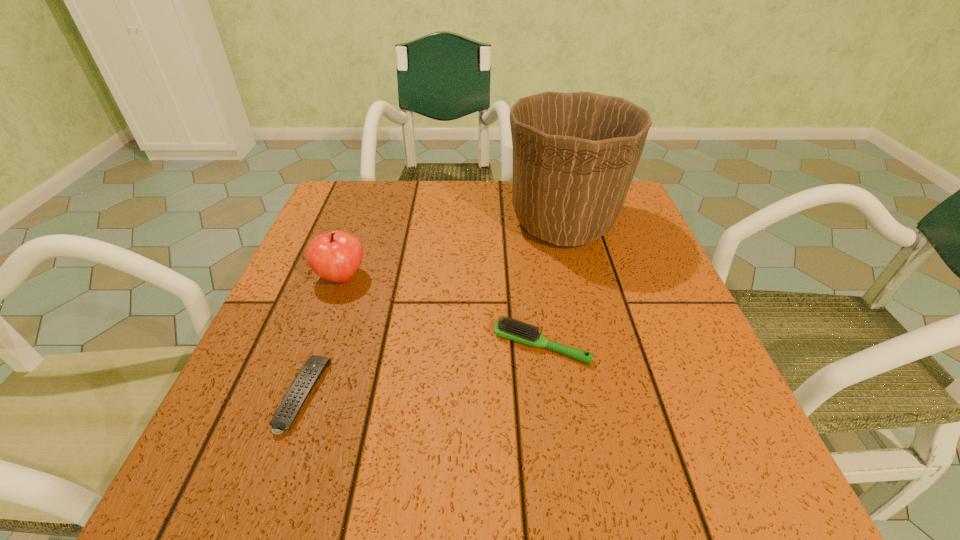
This screenshot has height=540, width=960. Find the location of `vacant space that is in between the remote control and the second shortest object`. vacant space that is in between the remote control and the second shortest object is located at coordinates (422, 370).

The image size is (960, 540). What are the coordinates of `unoccupied position between the second tallest object and the remote control` in the screenshot? It's located at (323, 336).

Locate an element on the screen. free space between the tallest object and the hairbrush is located at coordinates (553, 284).

What are the coordinates of `free spot between the shortest object and the apple` in the screenshot? It's located at pyautogui.click(x=323, y=336).

Locate an element on the screen. The image size is (960, 540). unoccupied area between the second shortest object and the flowerpot is located at coordinates (553, 284).

Locate an element on the screen. The image size is (960, 540). vacant region between the flowerpot and the shortest object is located at coordinates (433, 309).

Find the location of a particular element. Image resolution: width=960 pixels, height=540 pixels. free space that is in between the shortest object and the hairbrush is located at coordinates (422, 370).

Image resolution: width=960 pixels, height=540 pixels. I want to click on free space between the remote control and the second farthest object, so click(323, 336).

I want to click on free space that is in between the farthest object and the second farthest object, so click(452, 250).

Locate an element on the screen. the closest object to the hairbrush is located at coordinates (575, 154).